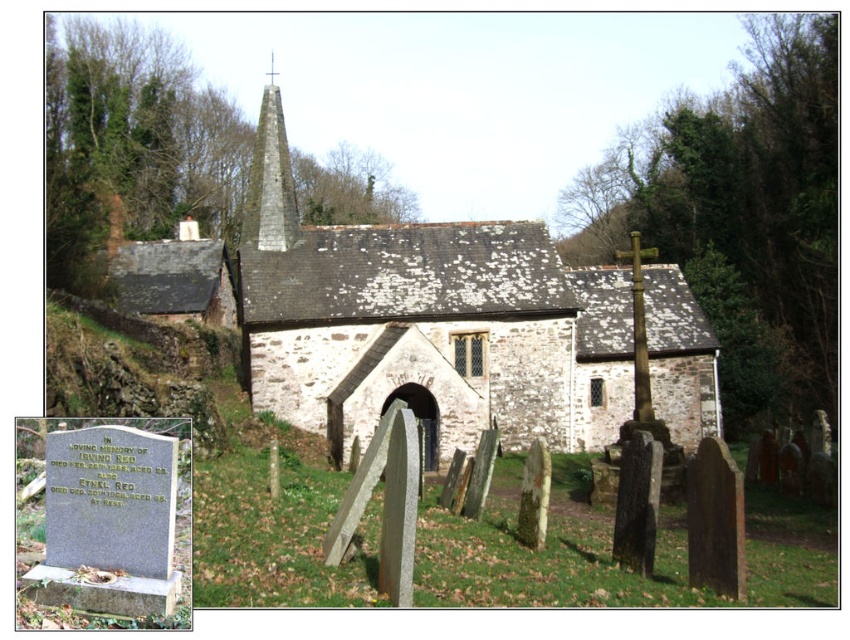
Can you confirm if stone church at center is smaller than smooth stone spire at center?

Yes.

The image size is (850, 640). Find the location of `stone church at center`. stone church at center is located at coordinates (456, 326).

Where is `stone church at center`? Image resolution: width=850 pixels, height=640 pixels. stone church at center is located at coordinates (456, 326).